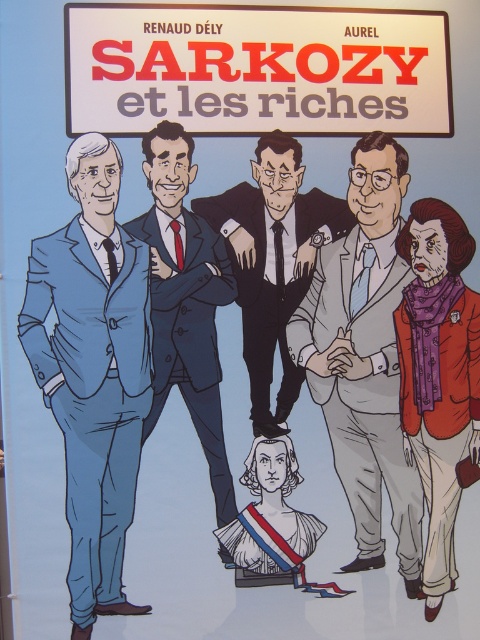
You are a political analyst observing this cartoon. The scene includes a white paper sign at upper center and a blue fabric suit at left. Which object is located above the other?

The white paper sign at upper center is positioned over blue fabric suit at left, meaning it is above it.

You are observing a political cartoon and notice two items of clothing. The purple fabric scarf at lower right and the blue suit at center. Which item is shorter in height?

The purple fabric scarf at lower right is not as tall as the blue suit at center, so the scarf is shorter in height.

You are an observer looking at the political cartoon. You notice the blue fabric suit at left and the purple fabric scarf at lower right. Which object is located more to the left in the image?

The blue fabric suit at left is positioned on the left side of the purple fabric scarf at lower right, so it is more to the left.